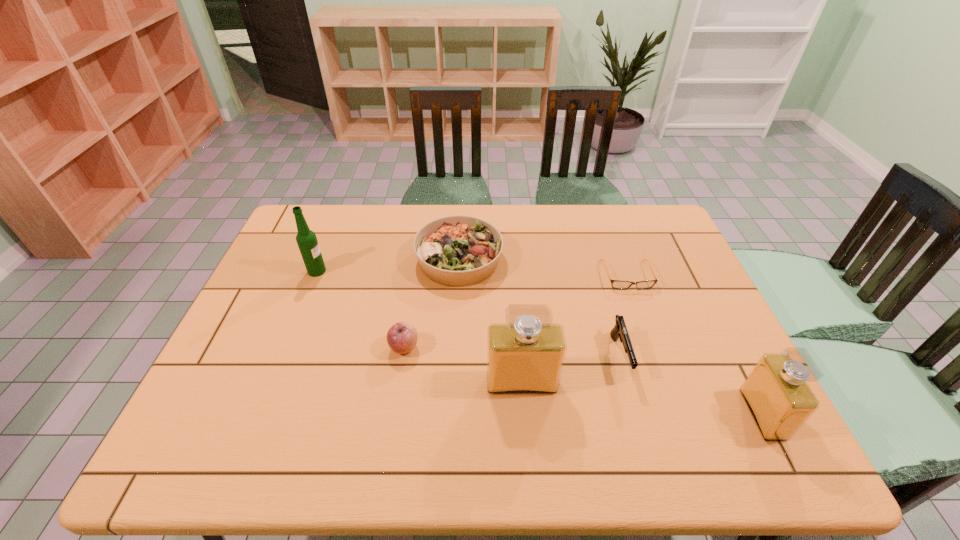
Where is `vacant area that lies between the beer bottle and the salad plate`? Image resolution: width=960 pixels, height=540 pixels. vacant area that lies between the beer bottle and the salad plate is located at coordinates (388, 266).

Locate an element on the screen. free point between the salad plate and the shorter perfume is located at coordinates coord(611,337).

The width and height of the screenshot is (960, 540). In order to click on vacant area that lies between the salad plate and the left perfume in this screenshot , I will do `click(491, 321)`.

I want to click on vacant region between the salad plate and the shortest object, so click(x=543, y=268).

This screenshot has width=960, height=540. In order to click on unoccupied position between the third object from right to left and the spectacles in this screenshot , I will do `click(623, 316)`.

I want to click on vacant area between the apple and the taller perfume, so click(463, 366).

The image size is (960, 540). What are the coordinates of `free space between the left perfume and the salad plate` in the screenshot? It's located at (491, 321).

Locate which object is the sixth closest to the left perfume. Please provide its 2D coordinates. Your answer should be formatted as a tuple, i.e. [(x, y)], where the tuple contains the x and y coordinates of a point satisfying the conditions above.

[(306, 239)]

You are a GUI agent. You are given a task and a screenshot of the screen. Output one action in this format:
    pyautogui.click(x=<x>, y=<y>)
    Task: Click on the object that can be found as the third closest to the taller perfume
    Image resolution: width=960 pixels, height=540 pixels.
    Given the screenshot: What is the action you would take?
    pyautogui.click(x=457, y=251)